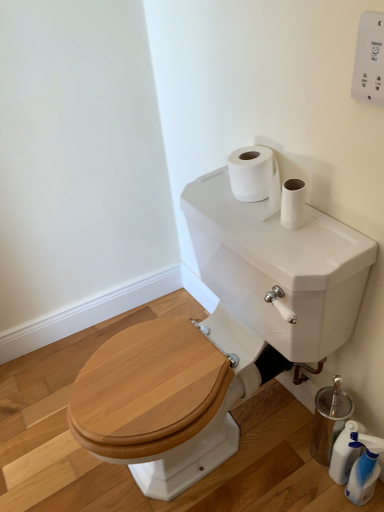
Question: Is white glossy tank at upper center facing towards white plastic remote control at upper right?

Choices:
 (A) yes
 (B) no

Answer: (B)

Question: Is white glossy tank at upper center thinner than white plastic remote control at upper right?

Choices:
 (A) no
 (B) yes

Answer: (A)

Question: Considering the relative sizes of white glossy tank at upper center and white plastic remote control at upper right in the image provided, is white glossy tank at upper center wider than white plastic remote control at upper right?

Choices:
 (A) yes
 (B) no

Answer: (A)

Question: Does white glossy tank at upper center have a greater height compared to white plastic remote control at upper right?

Choices:
 (A) yes
 (B) no

Answer: (A)

Question: Are white glossy tank at upper center and white plastic remote control at upper right beside each other?

Choices:
 (A) yes
 (B) no

Answer: (B)

Question: Is point (364, 59) closer or farther from the camera than point (160, 467)?

Choices:
 (A) closer
 (B) farther

Answer: (A)

Question: From their relative heights in the image, would you say white plastic remote control at upper right is taller or shorter than white glossy tank at upper center?

Choices:
 (A) short
 (B) tall

Answer: (A)

Question: Is white plastic remote control at upper right situated inside white glossy tank at upper center or outside?

Choices:
 (A) outside
 (B) inside

Answer: (A)

Question: Based on their positions, is white plastic remote control at upper right located to the left or right of white glossy tank at upper center?

Choices:
 (A) left
 (B) right

Answer: (B)

Question: From a real-world perspective, is translucent plastic bottle at lower right, which ranks as the 2th cleaning product in front-to-back order, above or below translucent plastic spray bottle at lower right, which is the 1th cleaning product in front-to-back order?

Choices:
 (A) below
 (B) above

Answer: (A)

Question: From their relative heights in the image, would you say translucent plastic bottle at lower right, marked as the 1th cleaning product in a back-to-front arrangement, is taller or shorter than translucent plastic spray bottle at lower right, which is the 1th cleaning product in front-to-back order?

Choices:
 (A) short
 (B) tall

Answer: (A)

Question: Is translucent plastic bottle at lower right, marked as the 1th cleaning product in a back-to-front arrangement, wider or thinner than translucent plastic spray bottle at lower right, the second cleaning product from the back?

Choices:
 (A) thin
 (B) wide

Answer: (A)

Question: From the image's perspective, relative to translucent plastic spray bottle at lower right, the second cleaning product from the back, is translucent plastic bottle at lower right, which ranks as the 2th cleaning product in front-to-back order, above or below?

Choices:
 (A) above
 (B) below

Answer: (A)

Question: Is translucent plastic spray bottle at lower right, which is the 1th cleaning product in front-to-back order, to the left or to the right of white plastic remote control at upper right in the image?

Choices:
 (A) right
 (B) left

Answer: (A)

Question: Considering the positions of point (349, 481) and point (372, 102), is point (349, 481) closer or farther from the camera than point (372, 102)?

Choices:
 (A) farther
 (B) closer

Answer: (A)